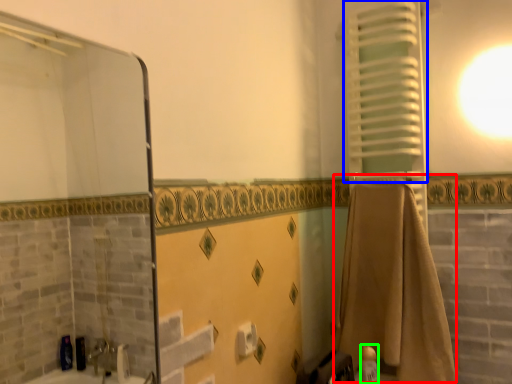
Question: Which is farther away from bath towel (highlighted by a red box)? curtain (highlighted by a blue box) or toiletry (highlighted by a green box)?

Choices:
 (A) curtain
 (B) toiletry

Answer: (A)